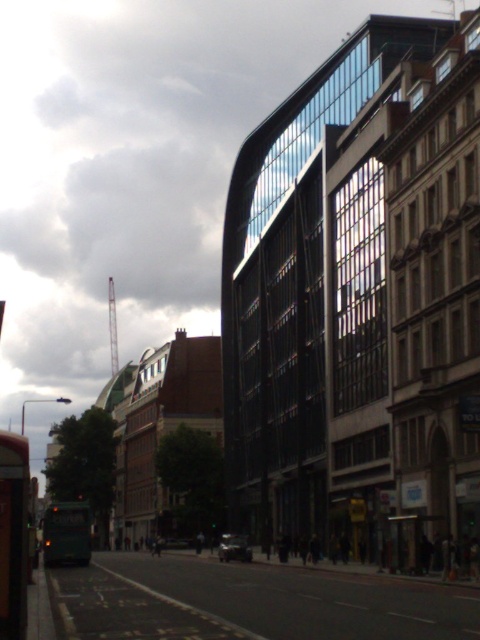
You are standing at the camera position and want to walk to both points. Which point should you reach first, point (120, 618) or point (70, 561)?

Point (120, 618) is closer to the camera than point (70, 561), so you will reach point (120, 618) first.

You are a delivery drone flying over an urban area. You need to land on the black asphalt road at center. What are the coordinates where you should aim to land?

The black asphalt road at center is located at point (250, 602), so you should aim for those coordinates to land safely.